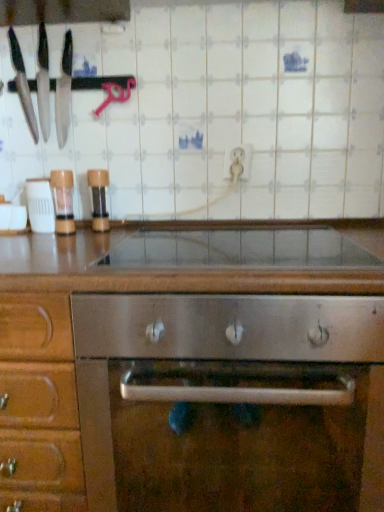
Image resolution: width=384 pixels, height=512 pixels. I want to click on clear plastic shaker at left, which ranks as the 2th appliance in right-to-left order, so click(63, 200).

This screenshot has width=384, height=512. What do you see at coordinates (43, 83) in the screenshot?
I see `stainless steel knives at left, which is counted as the first kitchen appliance, starting from the right` at bounding box center [43, 83].

Describe the element at coordinates (98, 198) in the screenshot. I see `brown wood pepper grinder at left, which ranks as the first appliance in right-to-left order` at that location.

What is the approximate height of brown wood pepper grinder at left, acting as the 3th appliance starting from the left?

It is 7.25 inches.

The height and width of the screenshot is (512, 384). Describe the element at coordinates (189, 371) in the screenshot. I see `stainless steel oven at center` at that location.

Locate an element on the screen. The height and width of the screenshot is (512, 384). transparent glass countertop at center is located at coordinates (185, 250).

Between stainless steel knives at left, which is counted as the first kitchen appliance, starting from the right, and matte black knives at left, the 1th kitchen appliance viewed from the left, which one has smaller width?

With smaller width is stainless steel knives at left, which is counted as the first kitchen appliance, starting from the right.

Can matte black knives at left, the 1th kitchen appliance viewed from the left, be found inside stainless steel knives at left, which is counted as the first kitchen appliance, starting from the right?

No, matte black knives at left, the 1th kitchen appliance viewed from the left, is not inside stainless steel knives at left, which is counted as the first kitchen appliance, starting from the right.

Can you confirm if stainless steel knives at left, which is counted as the first kitchen appliance, starting from the right, is positioned to the left of matte black knives at left, the 1th kitchen appliance viewed from the left?

No, stainless steel knives at left, which is counted as the first kitchen appliance, starting from the right, is not to the left of matte black knives at left, the 1th kitchen appliance viewed from the left.

Is white plastic container at left, which is the third appliance from right to left, positioned behind matte black knives at left, the 2th kitchen appliance viewed from the right?

Yes, the depth of white plastic container at left, which is the third appliance from right to left, is greater than that of matte black knives at left, the 2th kitchen appliance viewed from the right.

Could you measure the distance between white plastic container at left, which is the third appliance from right to left, and matte black knives at left, the 1th kitchen appliance viewed from the left?

white plastic container at left, which is the third appliance from right to left, is 10.20 inches from matte black knives at left, the 1th kitchen appliance viewed from the left.

Between white plastic container at left, which is the first appliance from left to right, and matte black knives at left, the 2th kitchen appliance viewed from the right, which one has less height?

With less height is white plastic container at left, which is the first appliance from left to right.

From the image's perspective, is white plastic container at left, which is the first appliance from left to right, under matte black knives at left, the 2th kitchen appliance viewed from the right?

Correct, white plastic container at left, which is the first appliance from left to right, appears lower than matte black knives at left, the 2th kitchen appliance viewed from the right, in the image.

Is point (48, 217) closer to viewer compared to point (104, 186)?

That is True.

From the image's perspective, which appliance is the 2nd one below the brown wood pepper grinder at left, which ranks as the first appliance in right-to-left order? Please provide its 2D coordinates.

[(40, 205)]

Can you see white plastic container at left, which is the first appliance from left to right, touching brown wood pepper grinder at left, acting as the 3th appliance starting from the left?

No, white plastic container at left, which is the first appliance from left to right, is not beside brown wood pepper grinder at left, acting as the 3th appliance starting from the left.

From a real-world perspective, who is located higher, white plastic container at left, which is the first appliance from left to right, or brown wood pepper grinder at left, acting as the 3th appliance starting from the left?

brown wood pepper grinder at left, acting as the 3th appliance starting from the left, is physically above.

Is stainless steel knives at left, which is counted as the first kitchen appliance, starting from the right, next to white plastic container at left, which is the third appliance from right to left, and touching it?

No, stainless steel knives at left, which is counted as the first kitchen appliance, starting from the right, is not with white plastic container at left, which is the third appliance from right to left.

From a real-world perspective, is stainless steel knives at left, which is counted as the first kitchen appliance, starting from the right, beneath white plastic container at left, which is the third appliance from right to left?

Actually, stainless steel knives at left, which is counted as the first kitchen appliance, starting from the right, is physically above white plastic container at left, which is the third appliance from right to left, in the real world.

Is stainless steel knives at left, which is counted as the first kitchen appliance, starting from the right, turned away from white plastic container at left, which is the third appliance from right to left?

No, stainless steel knives at left, which is counted as the first kitchen appliance, starting from the right, is not facing away from white plastic container at left, which is the third appliance from right to left.

In the image, is stainless steel knives at left, which is counted as the first kitchen appliance, starting from the right, on the left side or the right side of white plastic container at left, which is the third appliance from right to left?

From the image, it's evident that stainless steel knives at left, which is counted as the first kitchen appliance, starting from the right, is to the right of white plastic container at left, which is the third appliance from right to left.

How different are the orientations of matte black knives at left, the 2th kitchen appliance viewed from the right, and white plastic container at left, which is the third appliance from right to left, in degrees?

There is a 4.48-degree angle between the facing directions of matte black knives at left, the 2th kitchen appliance viewed from the right, and white plastic container at left, which is the third appliance from right to left.

Considering the sizes of objects matte black knives at left, the 2th kitchen appliance viewed from the right, and white plastic container at left, which is the third appliance from right to left, in the image provided, who is shorter, matte black knives at left, the 2th kitchen appliance viewed from the right, or white plastic container at left, which is the third appliance from right to left,?

white plastic container at left, which is the third appliance from right to left, is shorter.

Can you confirm if matte black knives at left, the 2th kitchen appliance viewed from the right, is wider than white plastic container at left, which is the third appliance from right to left?

Yes.

Are matte black knives at left, the 2th kitchen appliance viewed from the right, and white plastic container at left, which is the third appliance from right to left, located far from each other?

matte black knives at left, the 2th kitchen appliance viewed from the right, is near white plastic container at left, which is the third appliance from right to left, not far away.

Considering their positions, is stainless steel knives at left, which is counted as the first kitchen appliance, starting from the right, located in front of or behind transparent glass countertop at center?

Clearly, stainless steel knives at left, which is counted as the first kitchen appliance, starting from the right, is behind transparent glass countertop at center.

Where is `countertop beneath the stainless steel knives at left, which is counted as the first kitchen appliance, starting from the right (from a real-world perspective)`? Image resolution: width=384 pixels, height=512 pixels. countertop beneath the stainless steel knives at left, which is counted as the first kitchen appliance, starting from the right (from a real-world perspective) is located at coordinates (185, 250).

From the image's perspective, is stainless steel knives at left, which ranks as the 2th kitchen appliance in left-to-right order, over transparent glass countertop at center?

Yes.

Is point (53, 200) positioned after point (50, 217)?

No, (53, 200) is closer to viewer.

Is clear plastic shaker at left, placed as the second appliance when sorted from left to right, positioned in front of white plastic container at left, which is the first appliance from left to right?

Yes.

Based on the photo, is clear plastic shaker at left, which ranks as the 2th appliance in right-to-left order, placed right next to white plastic container at left, which is the first appliance from left to right?

Yes, clear plastic shaker at left, which ranks as the 2th appliance in right-to-left order, is in contact with white plastic container at left, which is the first appliance from left to right.

Based on the photo, from a real-world perspective, is clear plastic shaker at left, which ranks as the 2th appliance in right-to-left order, below white plastic container at left, which is the third appliance from right to left?

No, from a real-world perspective, clear plastic shaker at left, which ranks as the 2th appliance in right-to-left order, is not under white plastic container at left, which is the third appliance from right to left.

I want to click on kitchen appliance that is on the left side of stainless steel knives at left, which is counted as the first kitchen appliance, starting from the right, so click(x=22, y=85).

I want to click on kitchen appliance that appears in front of the white plastic container at left, which is the third appliance from right to left, so click(22, 85).

From the image, which object appears to be nearer to stainless steel knives at left, which ranks as the 2th kitchen appliance in left-to-right order, stainless steel oven at center or transparent glass countertop at center?

The object closer to stainless steel knives at left, which ranks as the 2th kitchen appliance in left-to-right order, is transparent glass countertop at center.

From the image, which object appears to be nearer to white plastic container at left, which is the third appliance from right to left, clear plastic shaker at left, which ranks as the 2th appliance in right-to-left order, or stainless steel oven at center?

clear plastic shaker at left, which ranks as the 2th appliance in right-to-left order, lies closer to white plastic container at left, which is the third appliance from right to left, than the other object.

When comparing their distances from clear plastic shaker at left, which ranks as the 2th appliance in right-to-left order, does matte black knives at left, the 1th kitchen appliance viewed from the left, or stainless steel oven at center seem further?

stainless steel oven at center is positioned further to the anchor clear plastic shaker at left, which ranks as the 2th appliance in right-to-left order.

Looking at the image, which one is located further to clear plastic shaker at left, which ranks as the 2th appliance in right-to-left order, white plastic container at left, which is the first appliance from left to right, or stainless steel oven at center?

Among the two, stainless steel oven at center is located further to clear plastic shaker at left, which ranks as the 2th appliance in right-to-left order.

Estimate the real-world distances between objects in this image. Which object is further from matte black knives at left, the 2th kitchen appliance viewed from the right, white plastic container at left, which is the first appliance from left to right, or stainless steel oven at center?

stainless steel oven at center is positioned further to the anchor matte black knives at left, the 2th kitchen appliance viewed from the right.

From the image, which object appears to be farther from brown wood pepper grinder at left, which ranks as the first appliance in right-to-left order, clear plastic shaker at left, placed as the second appliance when sorted from left to right, or transparent glass countertop at center?

transparent glass countertop at center lies further to brown wood pepper grinder at left, which ranks as the first appliance in right-to-left order, than the other object.

Looking at the image, which one is located closer to matte black knives at left, the 1th kitchen appliance viewed from the left, transparent glass countertop at center or stainless steel oven at center?

The object closer to matte black knives at left, the 1th kitchen appliance viewed from the left, is transparent glass countertop at center.

Which object lies further to the anchor point brown wood pepper grinder at left, acting as the 3th appliance starting from the left, transparent glass countertop at center or stainless steel oven at center?

Among the two, stainless steel oven at center is located further to brown wood pepper grinder at left, acting as the 3th appliance starting from the left.

Identify the location of countertop positioned between stainless steel oven at center and brown wood pepper grinder at left, acting as the 3th appliance starting from the left, from near to far. The width and height of the screenshot is (384, 512). (185, 250).

This screenshot has height=512, width=384. What are the coordinates of `countertop that lies between stainless steel knives at left, which ranks as the 2th kitchen appliance in left-to-right order, and stainless steel oven at center from top to bottom` in the screenshot? It's located at (185, 250).

This screenshot has width=384, height=512. In order to click on appliance between stainless steel knives at left, which ranks as the 2th kitchen appliance in left-to-right order, and clear plastic shaker at left, placed as the second appliance when sorted from left to right, in the up-down direction in this screenshot , I will do `click(98, 198)`.

This screenshot has width=384, height=512. What are the coordinates of `kitchen appliance between white plastic container at left, which is the third appliance from right to left, and transparent glass countertop at center from left to right` in the screenshot? It's located at (43, 83).